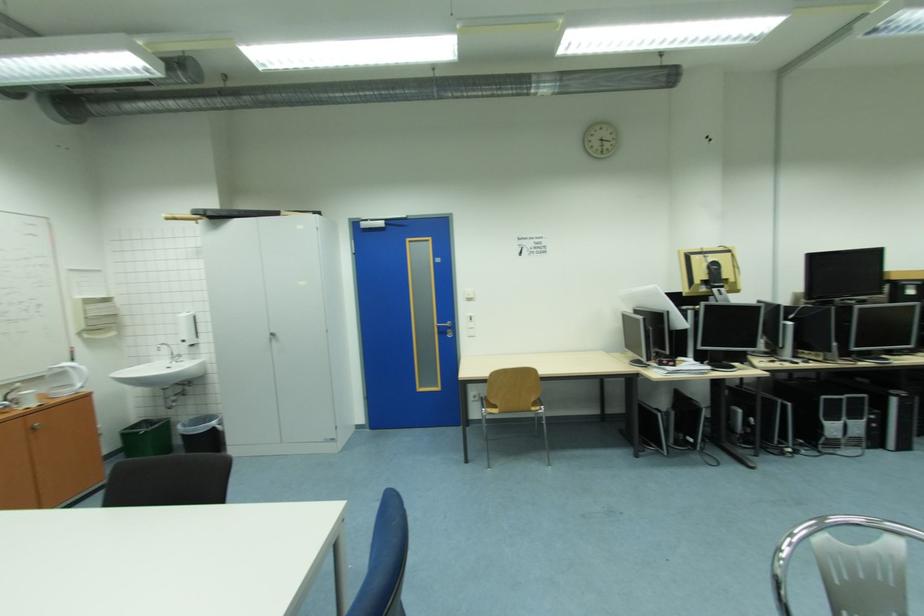
Locate an element on the screen. soap dispenser is located at coordinates (188, 328).